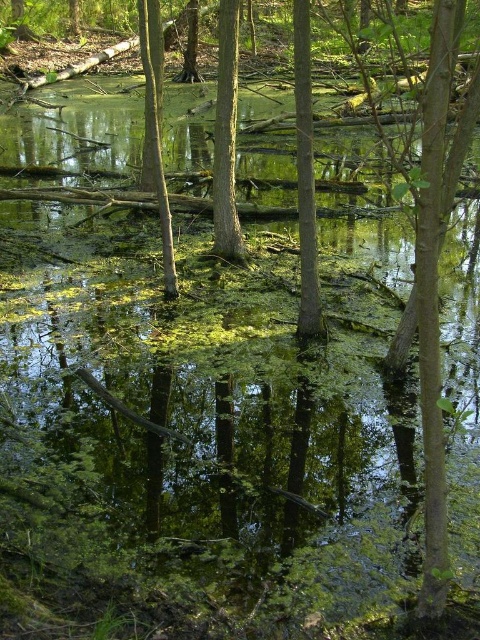
You are a bird looking for a place to perch. You see both the smooth bark tree at center and the green rough bark tree at center. Which tree would you choose if you want to land on the taller one?

The smooth bark tree at center is much taller than the green rough bark tree at center, so you should choose the smooth bark tree at center to land on.

Consider the image. You are standing in a swampy area and want to reach a point marked as point (225, 172). If you can walk 30 feet in 1 minute, how long will it take you to reach that point?

The distance between you and point (225, 172) is 26.68 feet. Since you can walk 30 feet in 1 minute, it will take you approximately 0.89 minutes or about 53 seconds to reach the point.

You are a bird flying over the swamp and want to land on the smooth bark tree at center. Based on its 2D coordinates, where exactly should you aim to land?

The smooth bark tree at center is located at the 2D coordinates point (x=305, y=177), so you should aim for that position to land on it.